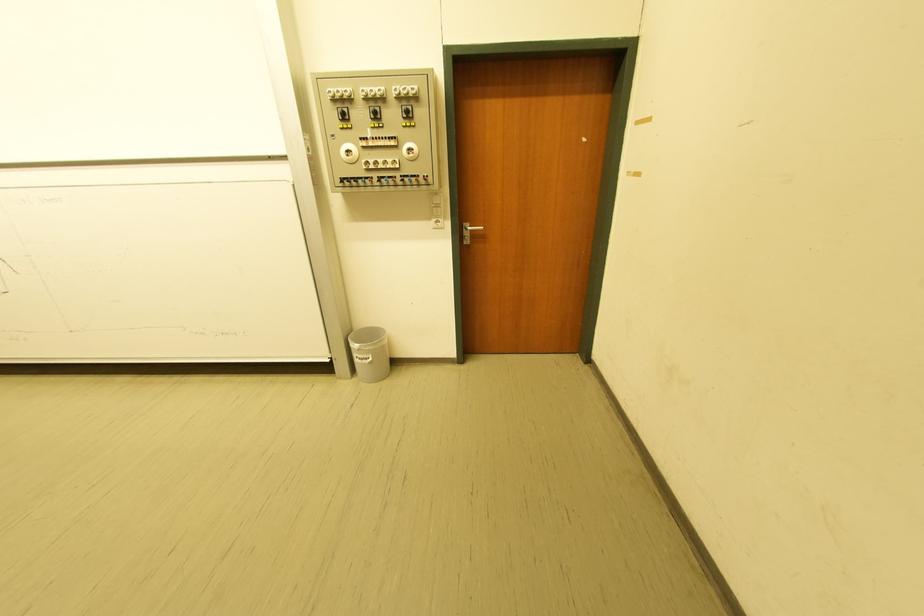
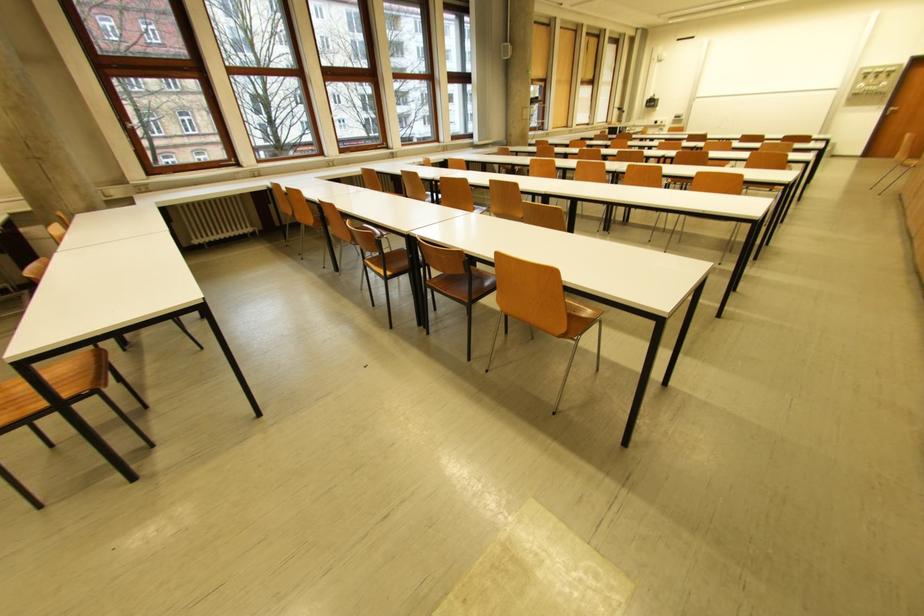
Where in the second image is the point corresponding to point (399, 116) from the first image?

(890, 77)